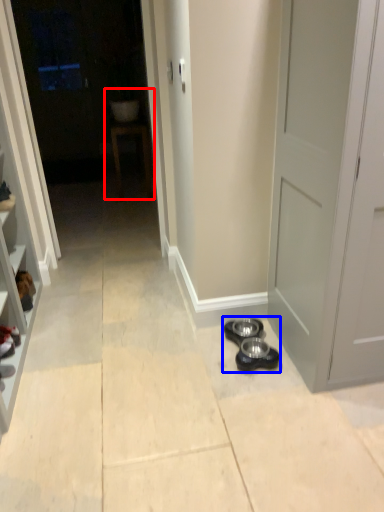
Question: Among these objects, which one is nearest to the camera, sink (highlighted by a red box) or shoe (highlighted by a blue box)?

Choices:
 (A) sink
 (B) shoe

Answer: (B)